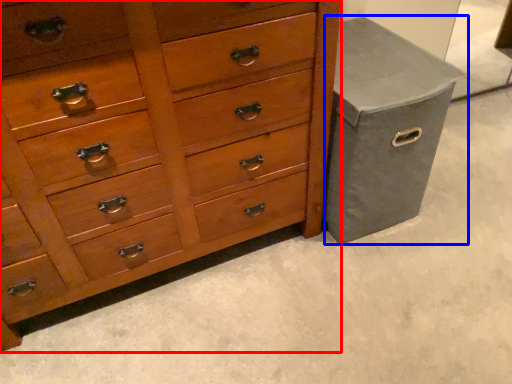
Question: Which of the following is the closest to the observer, chest of drawers (highlighted by a red box) or gray (highlighted by a blue box)?

Choices:
 (A) chest of drawers
 (B) gray

Answer: (A)